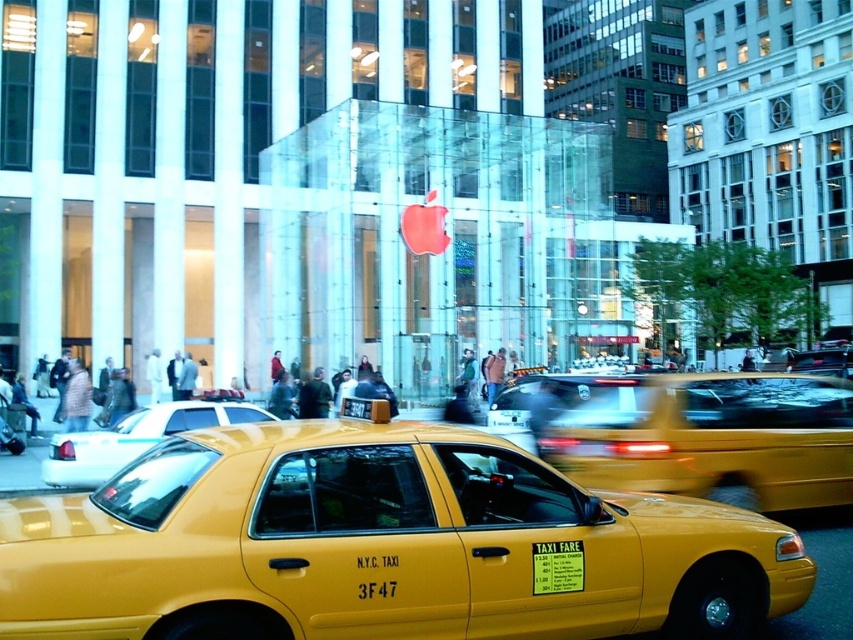
Can you confirm if matte yellow taxi at center is smaller than yellow plastic taxi cab at center?

Actually, matte yellow taxi at center might be larger than yellow plastic taxi cab at center.

Image resolution: width=853 pixels, height=640 pixels. I want to click on matte yellow taxi at center, so [380, 545].

The width and height of the screenshot is (853, 640). Identify the location of matte yellow taxi at center. (380, 545).

Between yellow matte taxi at center and yellow plastic taxi cab at center, which one has more height?

With more height is yellow matte taxi at center.

Can you confirm if yellow matte taxi at center is shorter than yellow plastic taxi cab at center?

Incorrect, yellow matte taxi at center's height does not fall short of yellow plastic taxi cab at center's.

Identify the location of yellow matte taxi at center. The width and height of the screenshot is (853, 640). (712, 438).

Locate an element on the screen. This screenshot has height=640, width=853. yellow matte taxi at center is located at coordinates (712, 438).

Who is positioned more to the left, matte yellow taxi at center or yellow matte taxi at center?

matte yellow taxi at center is more to the left.

Between point (670, 636) and point (804, 460), which one is positioned in front?

Point (670, 636) is in front.

At what (x,y) coordinates should I click in order to perform the action: click on matte yellow taxi at center. Please return your answer as a coordinate pair (x, y). Looking at the image, I should click on (380, 545).